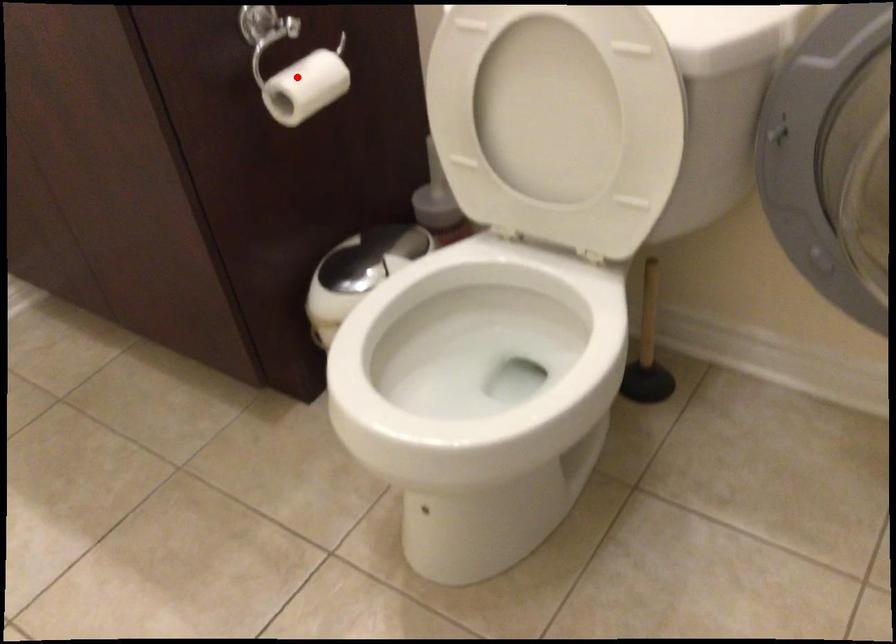
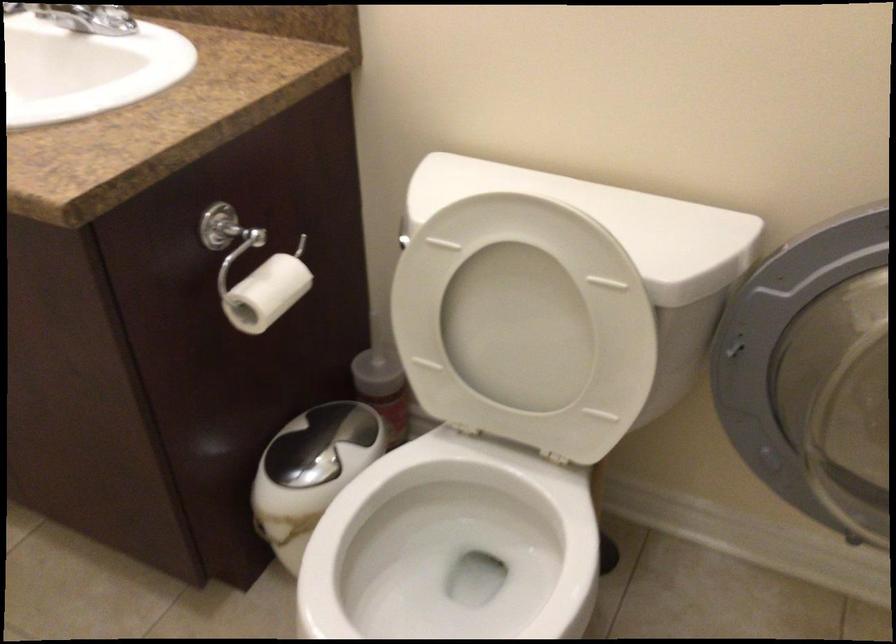
In the second image, find the point that corresponds to the highlighted location in the first image.

(263, 286)